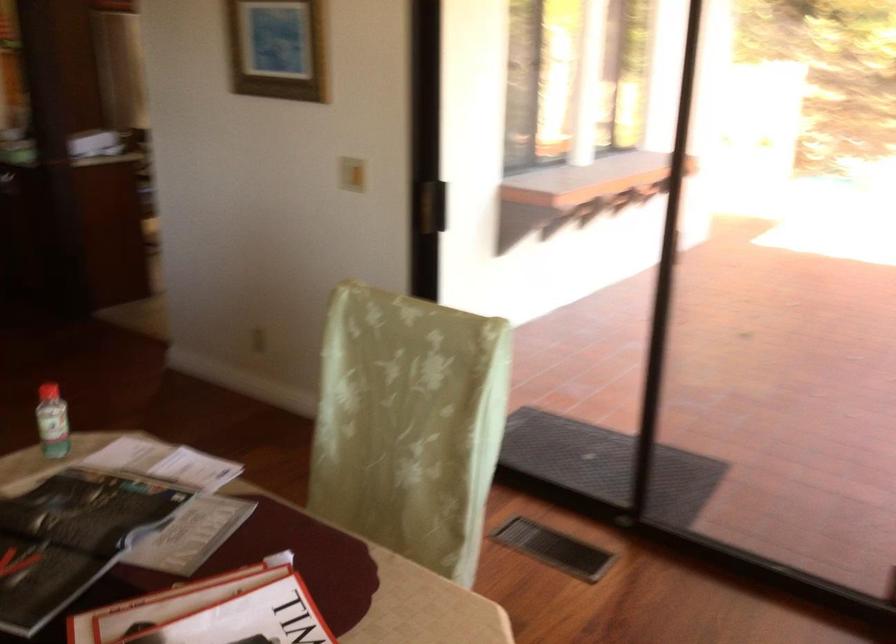
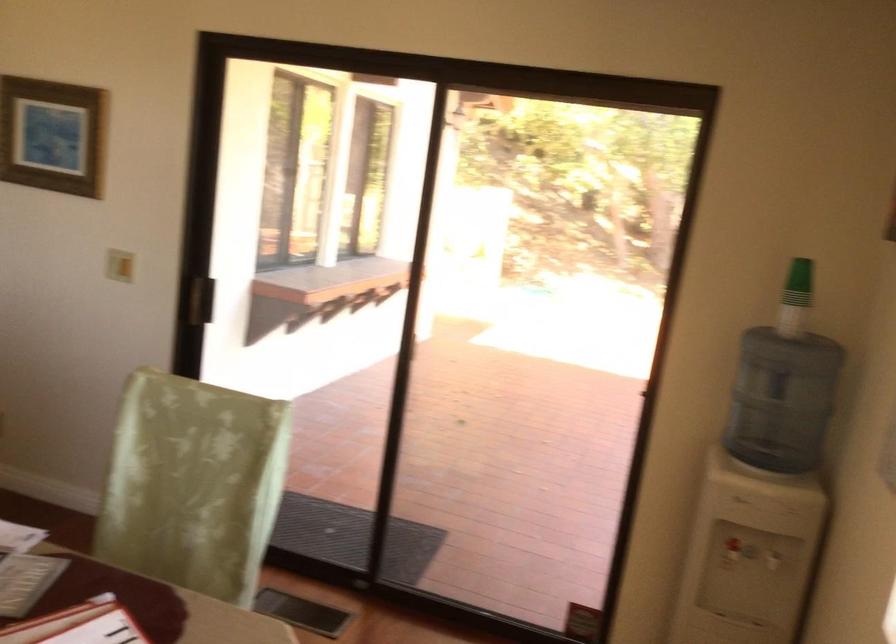
In the second image, find the point that corresponds to (383,506) in the first image.

(168, 565)